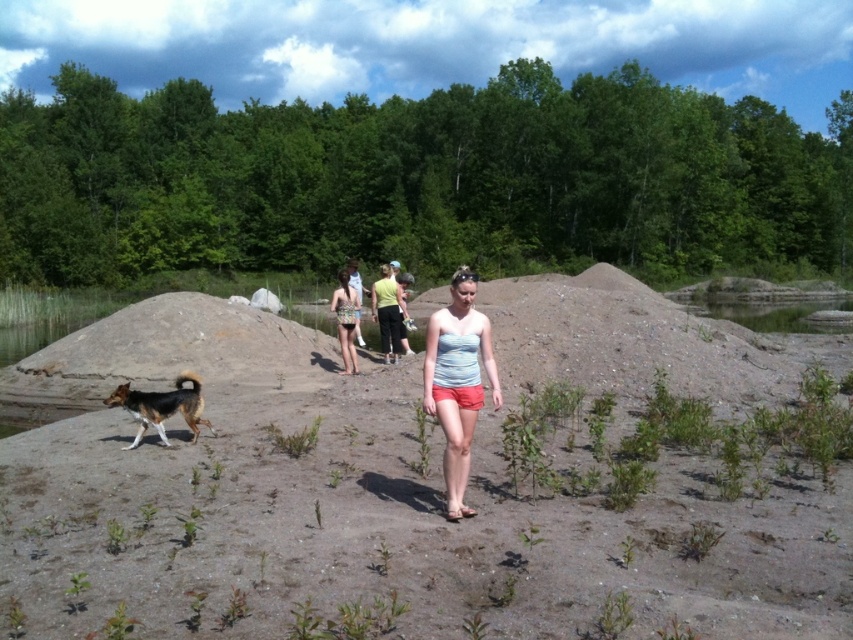
What is the exact coordinate of the brown sandy soil at center in the image?

The brown sandy soil at center is located at point (x=426, y=481).

You are planning to build a sandcastle on the brown sandy soil at center. Considering the size of the brown and black fur dog at lower left, will there be enough space for the sandcastle?

The brown sandy soil at center has a larger size compared to the brown and black fur dog at lower left, so there should be enough space to build a sandcastle there.

You are a photographer trying to capture a photo of the brown and black fur dog at lower left and the patterned swimsuit at center. Based on their sizes, which one would you need to get closer to in order to include both in the frame without zooming?

The brown and black fur dog at lower left is smaller than the patterned swimsuit at center, so you would need to get closer to the brown and black fur dog at lower left to include both in the frame without zooming.